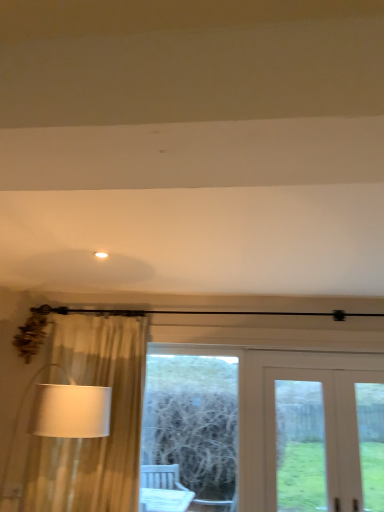
Question: Is white matte light fixture at upper center at the right side of wooden frame at center?

Choices:
 (A) yes
 (B) no

Answer: (B)

Question: Is white matte light fixture at upper center outside wooden frame at center?

Choices:
 (A) no
 (B) yes

Answer: (B)

Question: Is white matte light fixture at upper center bigger than wooden frame at center?

Choices:
 (A) yes
 (B) no

Answer: (B)

Question: From the image's perspective, is white matte light fixture at upper center beneath wooden frame at center?

Choices:
 (A) no
 (B) yes

Answer: (A)

Question: Considering the relative positions of white matte light fixture at upper center and wooden frame at center in the image provided, is white matte light fixture at upper center to the left of wooden frame at center from the viewer's perspective?

Choices:
 (A) yes
 (B) no

Answer: (A)

Question: Considering the relative sizes of white matte light fixture at upper center and wooden frame at center in the image provided, is white matte light fixture at upper center shorter than wooden frame at center?

Choices:
 (A) no
 (B) yes

Answer: (B)

Question: Is white fabric lampshade at left at the back of white wooden door at center?

Choices:
 (A) no
 (B) yes

Answer: (A)

Question: Is white wooden door at center not inside white fabric lampshade at left?

Choices:
 (A) no
 (B) yes

Answer: (B)

Question: From a real-world perspective, is white wooden door at center physically above white fabric lampshade at left?

Choices:
 (A) no
 (B) yes

Answer: (B)

Question: Is white fabric lampshade at left a part of white wooden door at center?

Choices:
 (A) yes
 (B) no

Answer: (B)

Question: Is white wooden door at center smaller than white fabric lampshade at left?

Choices:
 (A) yes
 (B) no

Answer: (A)

Question: Considering the relative sizes of white wooden door at center and white fabric lampshade at left in the image provided, is white wooden door at center shorter than white fabric lampshade at left?

Choices:
 (A) yes
 (B) no

Answer: (B)

Question: Can you confirm if white fabric lampshade at left is taller than wooden frame at center?

Choices:
 (A) no
 (B) yes

Answer: (A)